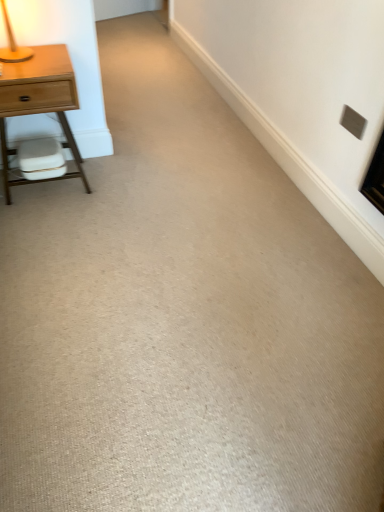
This screenshot has width=384, height=512. Identify the location of free point above light wood/finish nightstand at left (from a real-world perspective). (34, 61).